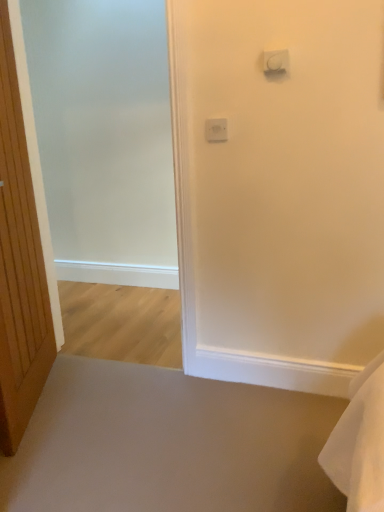
Question: Is frosted glass screen door at left spatially inside wooden door at left, or outside of it?

Choices:
 (A) outside
 (B) inside

Answer: (A)

Question: Visually, is frosted glass screen door at left positioned to the left or to the right of wooden door at left?

Choices:
 (A) left
 (B) right

Answer: (B)

Question: Considering the real-world distances, which object is closest to the frosted glass screen door at left?

Choices:
 (A) white plastic light switch at upper center, marked as the first light switch in a top-to-bottom arrangement
 (B) white plastic light switch at upper center, positioned as the second light switch in top-to-bottom order
 (C) wooden door at left

Answer: (C)

Question: Which object is the farthest from the white plastic light switch at upper center, the 1th light switch positioned from the left?

Choices:
 (A) wooden door at left
 (B) white plastic light switch at upper center, the 1th light switch from the right
 (C) frosted glass screen door at left

Answer: (C)